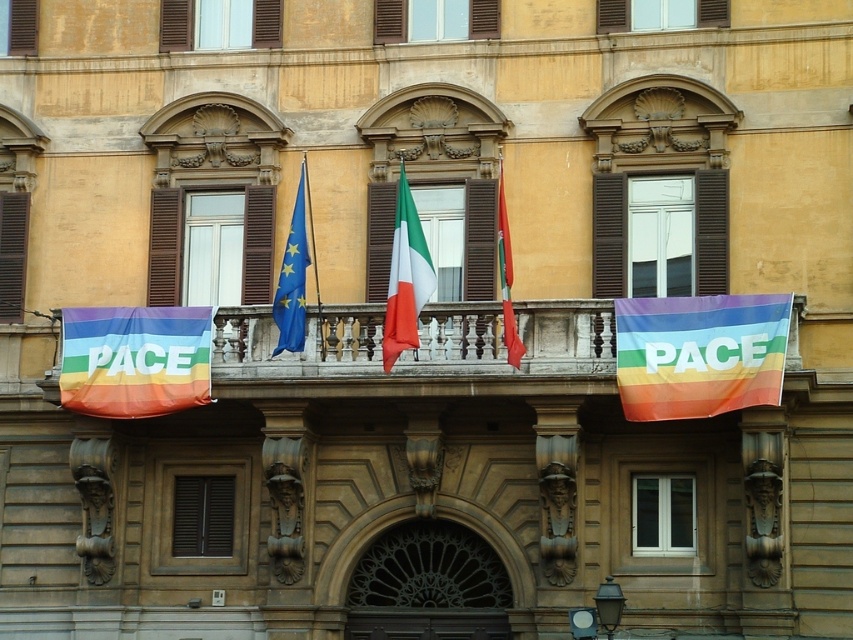
Which is below, rainbow fabric banner at left or matte fabric flag at center?

rainbow fabric banner at left is lower down.

From the picture: Between rainbow fabric banner at left and matte fabric flag at center, which one appears on the right side from the viewer's perspective?

Positioned to the right is matte fabric flag at center.

Identify the location of rainbow fabric banner at left. click(135, 358).

What are the coordinates of `rainbow fabric banner at left` in the screenshot? It's located at tap(135, 358).

Is the position of rainbow fabric banner at center more distant than that of blue fabric flag at center?

That is False.

Is point (685, 358) behind point (299, 204)?

That is False.

You are a GUI agent. You are given a task and a screenshot of the screen. Output one action in this format:
    pyautogui.click(x=<x>, y=<y>)
    Task: Click on the rainbow fabric banner at center
    
    Given the screenshot: What is the action you would take?
    pyautogui.click(x=699, y=353)

Between white cotton flag at center and blue fabric flag at center, which one is positioned lower?

blue fabric flag at center is below.

Is point (427, 282) less distant than point (277, 292)?

Yes, point (427, 282) is in front of point (277, 292).

What do you see at coordinates (405, 276) in the screenshot?
I see `white cotton flag at center` at bounding box center [405, 276].

Locate an element on the screen. The image size is (853, 640). white cotton flag at center is located at coordinates (405, 276).